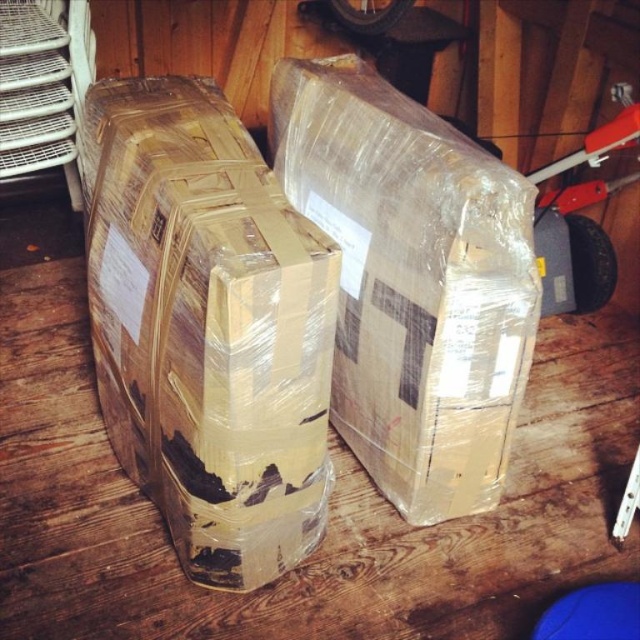
You are organizing a storage area and need to stack items on top of the brown cardboard box at center and the clear plastic box at center. Which box can support heavier items if the taller box is stronger?

The clear plastic box at center is taller and therefore stronger, so it can support heavier items.